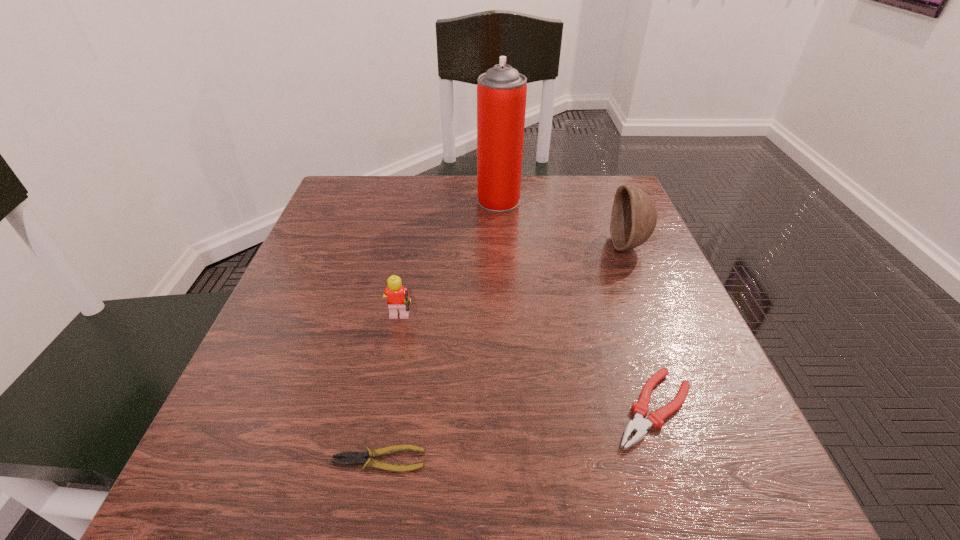
The height and width of the screenshot is (540, 960). Find the location of `the tallest object`. the tallest object is located at coordinates (501, 92).

You are a GUI agent. You are given a task and a screenshot of the screen. Output one action in this format:
    pyautogui.click(x=<x>, y=<y>)
    Task: Click on the farthest object
    
    Given the screenshot: What is the action you would take?
    pyautogui.click(x=501, y=92)

Find the location of a particular element. The image size is (960, 540). bowl is located at coordinates (634, 216).

This screenshot has width=960, height=540. Identify the location of the second tallest object. (634, 216).

Identify the location of Lego. (398, 300).

The image size is (960, 540). In order to click on the third tallest object in this screenshot , I will do `click(398, 300)`.

This screenshot has width=960, height=540. Find the location of `the right pliers`. the right pliers is located at coordinates (639, 424).

This screenshot has width=960, height=540. I want to click on the taller pliers, so click(639, 424).

Identify the location of the left pliers. The image size is (960, 540). (356, 458).

At what (x,y) coordinates should I click in order to perform the action: click on the shortest object. Please return your answer as a coordinate pair (x, y). The image size is (960, 540). Looking at the image, I should click on (356, 458).